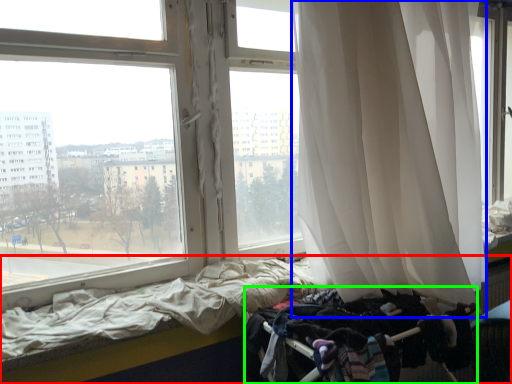
Question: Which is nearer to the bed (highlighted by a red box)? curtain (highlighted by a blue box) or baby carriage (highlighted by a green box).

Choices:
 (A) curtain
 (B) baby carriage

Answer: (B)